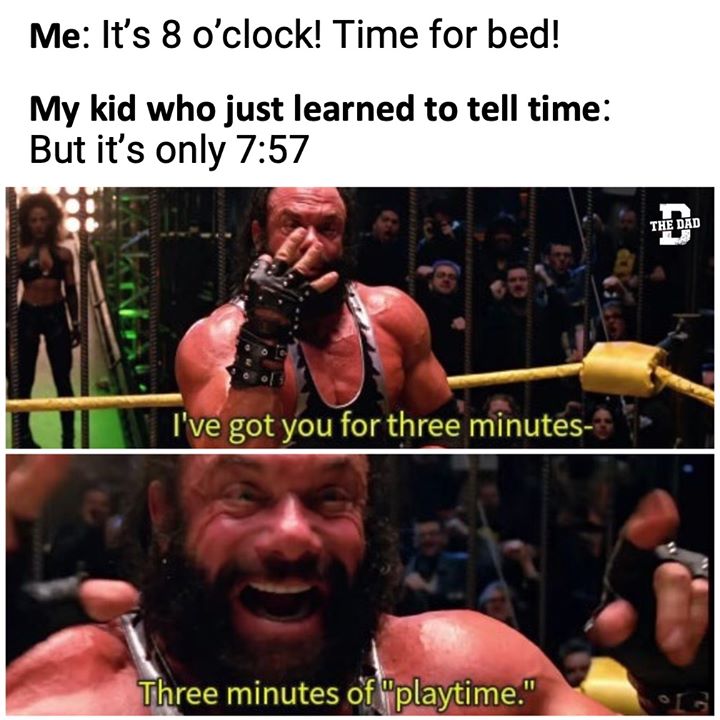
Identify the location of corner. Image resolution: width=720 pixels, height=720 pixels. (623, 366).